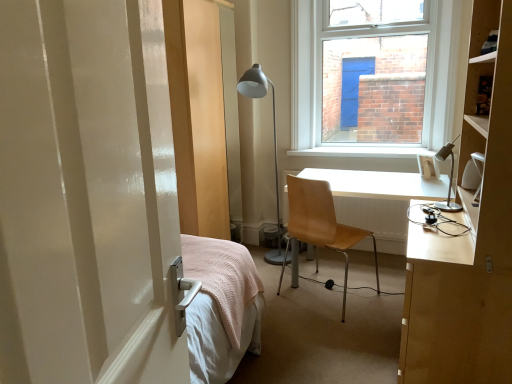
You are a GUI agent. You are given a task and a screenshot of the screen. Output one action in this format:
    pyautogui.click(x=<x>, y=<y>)
    Task: Click on the free space between light brown wood desk at center right and light brown wood chair at center
    This screenshot has width=512, height=384.
    Given the screenshot: What is the action you would take?
    pyautogui.click(x=372, y=315)